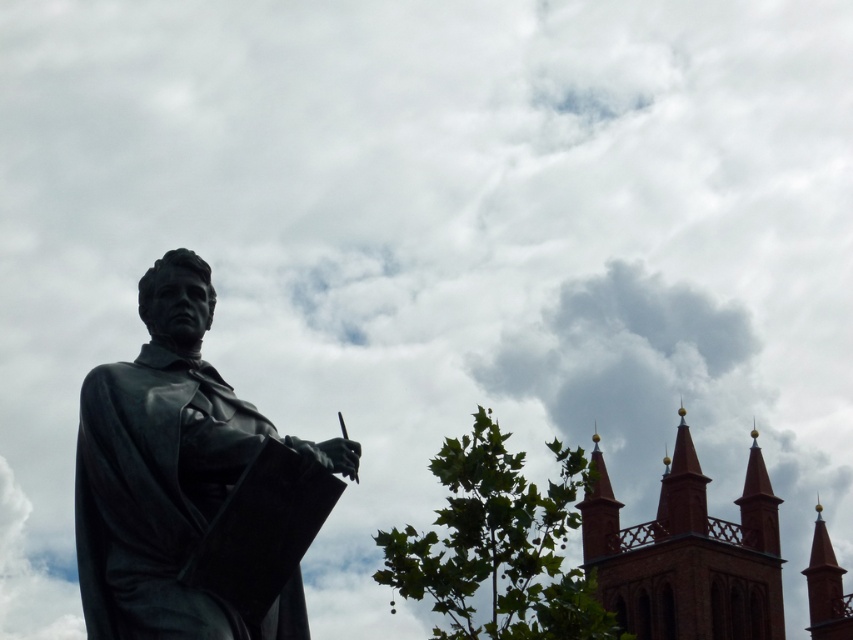
Question: Can you confirm if dark brown stone tower at upper right is bigger than brick steeple at upper right?

Choices:
 (A) yes
 (B) no

Answer: (A)

Question: Is bronze statue at left behind dark brown stone tower at upper right?

Choices:
 (A) no
 (B) yes

Answer: (A)

Question: Is brick steeple at upper right wider than brick spire at upper right?

Choices:
 (A) no
 (B) yes

Answer: (A)

Question: Estimate the real-world distances between objects in this image. Which object is farther from the dark brown stone tower at upper right?

Choices:
 (A) brick steeple at upper right
 (B) bronze statue at left

Answer: (B)

Question: Among these points, which one is farthest from the camera?

Choices:
 (A) (209, 284)
 (B) (813, 628)
 (C) (753, 568)

Answer: (B)

Question: Which of the following is the closest to the observer?

Choices:
 (A) brick steeple at upper right
 (B) brick spire at upper right

Answer: (B)